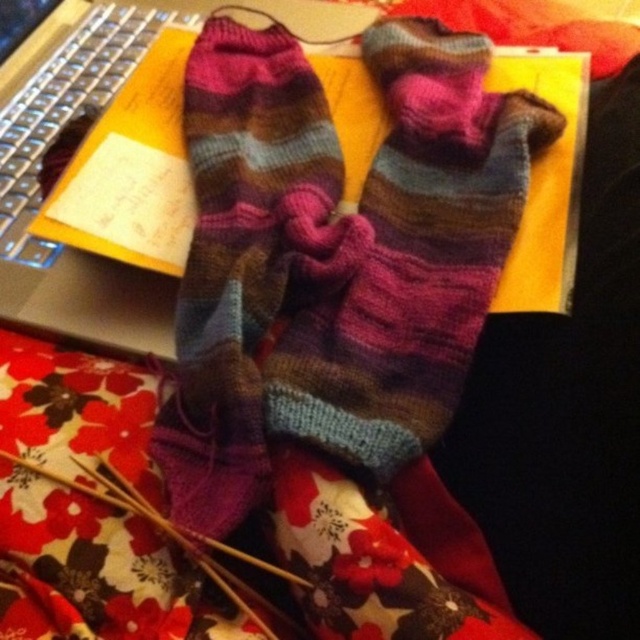
Is point (381, 401) farther from viewer compared to point (90, 65)?

No.

Measure the distance between multicolored knitted sock at center and camera.

multicolored knitted sock at center is 17.59 inches away from camera.

Identify the location of multicolored knitted sock at center. This screenshot has width=640, height=640. (404, 253).

Measure the distance between multicolored knitted sock at center and multicolored knitted scarf at center.

A distance of 7.37 centimeters exists between multicolored knitted sock at center and multicolored knitted scarf at center.

Who is higher up, multicolored knitted sock at center or multicolored knitted scarf at center?

Positioned higher is multicolored knitted sock at center.

You are a GUI agent. You are given a task and a screenshot of the screen. Output one action in this format:
    pyautogui.click(x=<x>, y=<y>)
    Task: Click on the multicolored knitted sock at center
    This screenshot has width=640, height=640.
    Given the screenshot: What is the action you would take?
    pyautogui.click(x=404, y=253)

Does multicolored knitted scarf at center appear on the left side of silver metallic laptop at upper left?

No, multicolored knitted scarf at center is not to the left of silver metallic laptop at upper left.

Between multicolored knitted scarf at center and silver metallic laptop at upper left, which one has less height?

With less height is multicolored knitted scarf at center.

Does point (237, 276) come behind point (340, 20)?

No, it is not.

Locate an element on the screen. The width and height of the screenshot is (640, 640). multicolored knitted scarf at center is located at coordinates (252, 269).